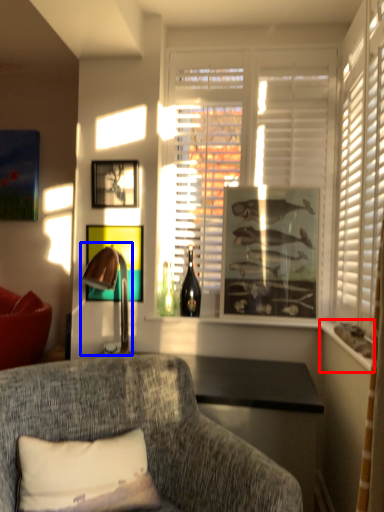
Question: Which of the following is the closest to the observer, window sill (highlighted by a red box) or table lamp (highlighted by a blue box)?

Choices:
 (A) window sill
 (B) table lamp

Answer: (A)